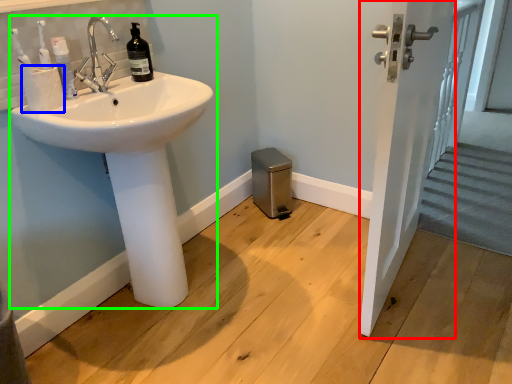
Question: Considering the real-world distances, which object is farthest from screen door (highlighted by a red box)? toilet paper (highlighted by a blue box) or sink (highlighted by a green box)?

Choices:
 (A) toilet paper
 (B) sink

Answer: (A)